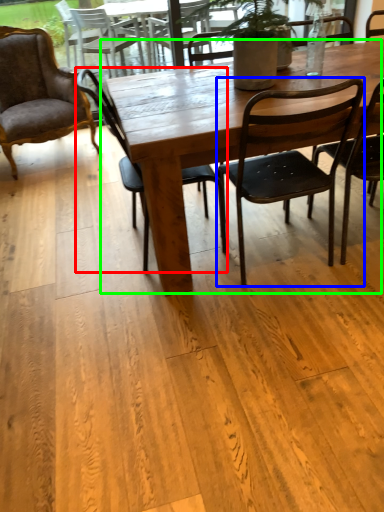
Question: Based on their relative distances, which object is farther from chair (highlighted by a red box)? Choose from chair (highlighted by a blue box) and kitchen & dining room table (highlighted by a green box).

Choices:
 (A) chair
 (B) kitchen & dining room table

Answer: (A)